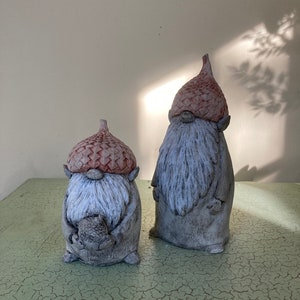
In order to click on ground's corner to the walls in this screenshot , I will do `click(30, 178)`.